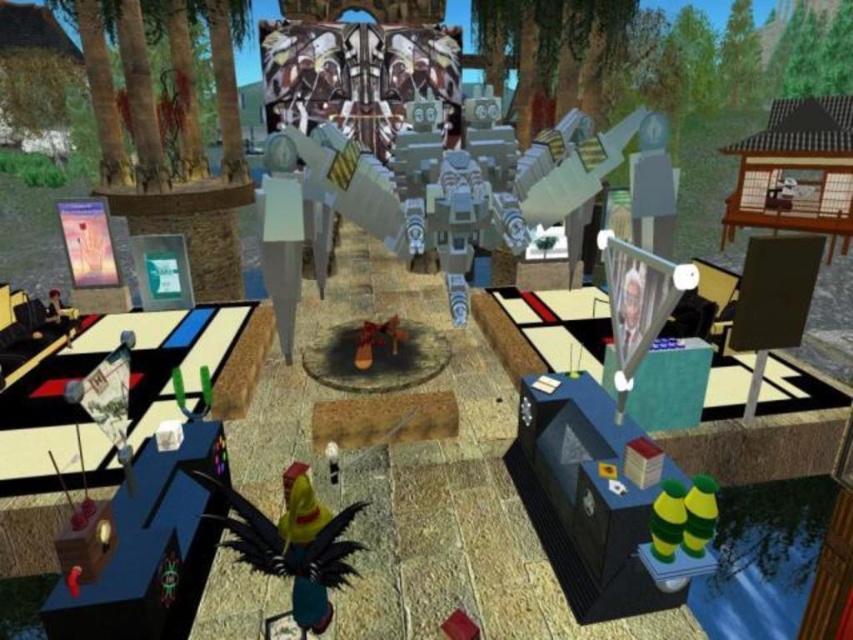
You are navigating a virtual environment and need to determine which of the two points, point (639,289) or point (80,248), is closer to your current viewpoint. Based on the scene description, which point is nearer?

Point (639,289) is closer to the camera than point (80,248).

You are a character in the game and need to pick up the shiny yellow toy at center and the metallic silver poster at left. Which object should you reach for first to grab the closest one?

The shiny yellow toy at center is closer to the viewer than the metallic silver poster at left, so you should reach for the shiny yellow toy at center first.